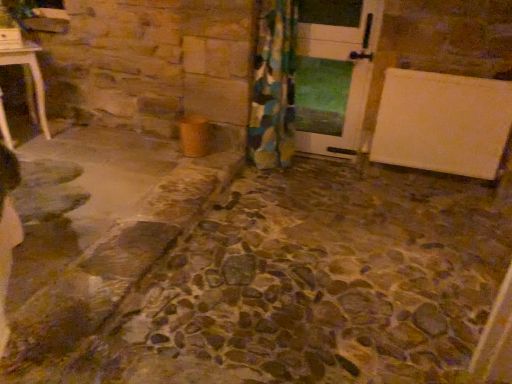
Describe the element at coordinates (273, 87) in the screenshot. I see `floral fabric curtain at center` at that location.

At what (x,y) coordinates should I click in order to perform the action: click on floral fabric curtain at center. Please return your answer as a coordinate pair (x, y). Looking at the image, I should click on tap(273, 87).

Locate an element on the screen. white glossy door at center is located at coordinates (351, 75).

What do you see at coordinates (351, 75) in the screenshot? The width and height of the screenshot is (512, 384). I see `white glossy door at center` at bounding box center [351, 75].

Where is `floral fabric curtain at center`? The height and width of the screenshot is (384, 512). floral fabric curtain at center is located at coordinates (273, 87).

In the image, is white glossy door at center on the left side or the right side of floral fabric curtain at center?

white glossy door at center is to the right of floral fabric curtain at center.

Which object is closer to the camera, white glossy door at center or floral fabric curtain at center?

→ Positioned in front is floral fabric curtain at center.

Is point (341, 27) closer to camera compared to point (282, 58)?

Yes, it is.

Based on the photo, from the image's perspective, is white glossy door at center over floral fabric curtain at center?

Correct, white glossy door at center appears higher than floral fabric curtain at center in the image.

From a real-world perspective, relative to floral fabric curtain at center, is white glossy door at center vertically above or below?

Clearly, from a real-world perspective, white glossy door at center is above floral fabric curtain at center.

Is white glossy door at center wider or thinner than floral fabric curtain at center?

Clearly, white glossy door at center has less width compared to floral fabric curtain at center.

In the scene shown: Who is shorter, white glossy door at center or floral fabric curtain at center?

white glossy door at center.

Which of these two, white glossy door at center or floral fabric curtain at center, is smaller?

white glossy door at center.

Which is correct: white glossy door at center is inside floral fabric curtain at center, or outside of it?

white glossy door at center is not enclosed by floral fabric curtain at center.

Based on the photo, is the surface of white glossy door at center in direct contact with floral fabric curtain at center?

white glossy door at center and floral fabric curtain at center are not in contact.

Is floral fabric curtain at center at the back of white glossy door at center?

No, white glossy door at center's orientation is not away from floral fabric curtain at center.

Can you tell me how much white glossy door at center and floral fabric curtain at center differ in facing direction?

There is a 0.633-degree angle between the facing directions of white glossy door at center and floral fabric curtain at center.

Find the location of a particular element. curtain lying below the white glossy door at center (from the image's perspective) is located at coordinates (273, 87).

Between floral fabric curtain at center and white glossy door at center, which one appears on the right side from the viewer's perspective?

From the viewer's perspective, white glossy door at center appears more on the right side.

Relative to white glossy door at center, is floral fabric curtain at center in front or behind?

floral fabric curtain at center is positioned closer to the viewer than white glossy door at center.

Is point (286, 19) closer or farther from the camera than point (356, 67)?

Point (286, 19) is positioned closer to the camera compared to point (356, 67).

From the image's perspective, is floral fabric curtain at center under white glossy door at center?

Correct, floral fabric curtain at center appears lower than white glossy door at center in the image.

From a real-world perspective, is floral fabric curtain at center located higher than white glossy door at center?

Incorrect, from a real-world perspective, floral fabric curtain at center is lower than white glossy door at center.

Which of these two, floral fabric curtain at center or white glossy door at center, is thinner?

white glossy door at center is thinner.

Between floral fabric curtain at center and white glossy door at center, which one has more height?

Standing taller between the two is floral fabric curtain at center.

Who is smaller, floral fabric curtain at center or white glossy door at center?

white glossy door at center is smaller.

Is floral fabric curtain at center not within white glossy door at center?

floral fabric curtain at center lies outside white glossy door at center's area.

Are floral fabric curtain at center and white glossy door at center making contact?

No, floral fabric curtain at center is not next to white glossy door at center.

Is floral fabric curtain at center turned away from white glossy door at center?

No, floral fabric curtain at center is not facing the opposite direction of white glossy door at center.

What's the angular difference between floral fabric curtain at center and white glossy door at center's facing directions?

floral fabric curtain at center and white glossy door at center are facing 0.633 degrees away from each other.

Find the location of a particular element. curtain below the white glossy door at center (from the image's perspective) is located at coordinates 273,87.

Where is `curtain below the white glossy door at center (from a real-world perspective)`? This screenshot has height=384, width=512. curtain below the white glossy door at center (from a real-world perspective) is located at coordinates (273, 87).

Where is `door above the floral fabric curtain at center (from the image's perspective)`? The width and height of the screenshot is (512, 384). door above the floral fabric curtain at center (from the image's perspective) is located at coordinates (351, 75).